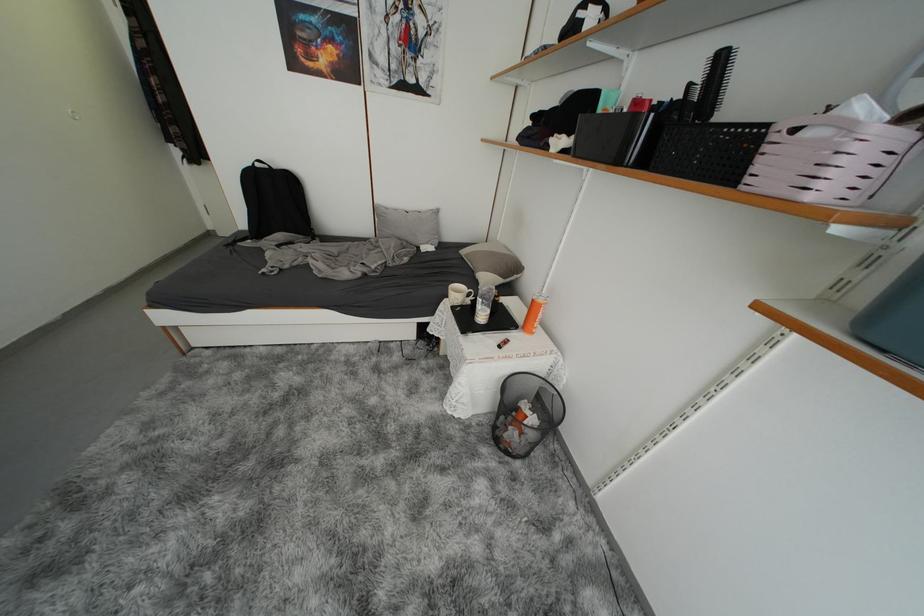
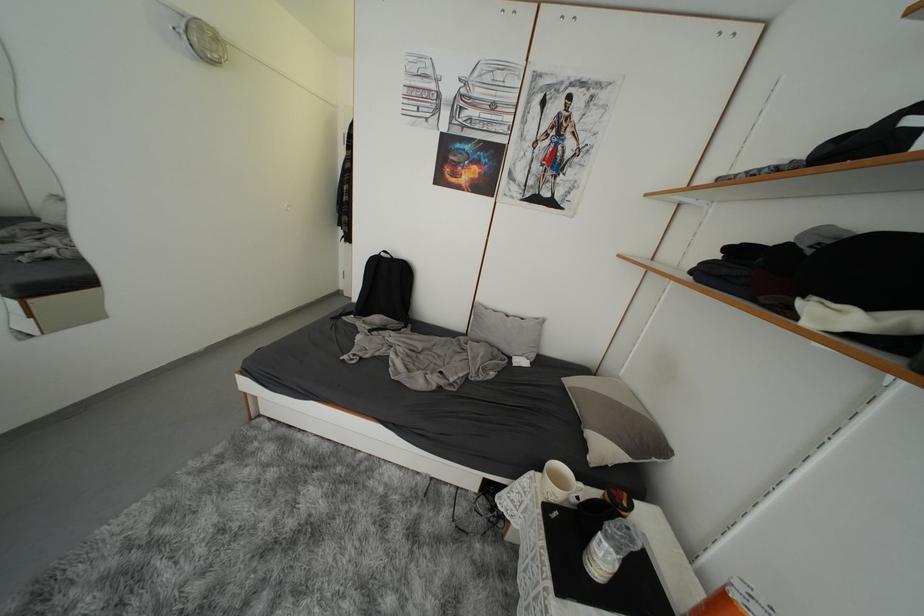
Find the pixel in the second image that matches point (415, 213) in the first image.

(516, 315)